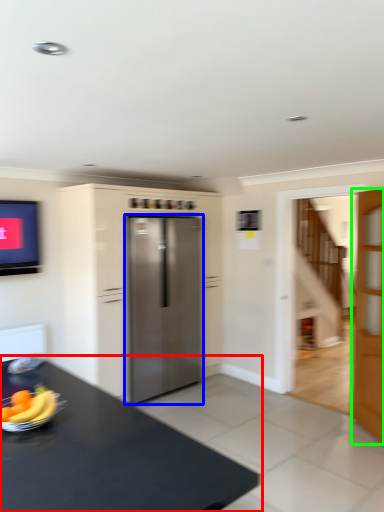
Question: Estimate the real-world distances between objects in this image. Which object is closer to table (highlighted by a red box), refrigerator (highlighted by a blue box) or door (highlighted by a green box)?

Choices:
 (A) refrigerator
 (B) door

Answer: (A)